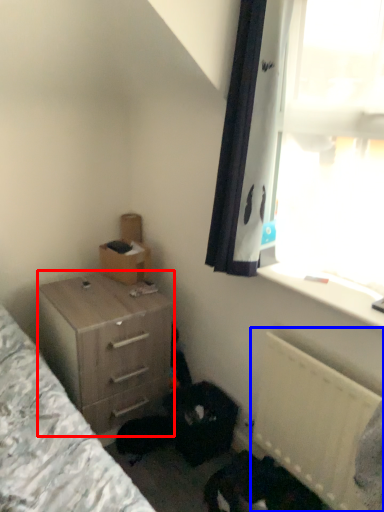
Question: Which point is further to the camera, chest of drawers (highlighted by a red box) or radiator (highlighted by a blue box)?

Choices:
 (A) chest of drawers
 (B) radiator

Answer: (A)